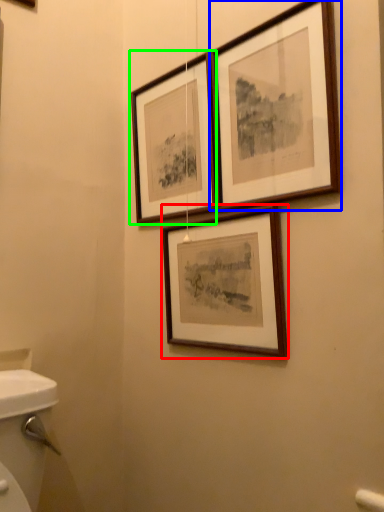
Question: Which object is the farthest from picture frame (highlighted by a red box)? Choose among these: picture frame (highlighted by a blue box) or picture frame (highlighted by a green box).

Choices:
 (A) picture frame
 (B) picture frame

Answer: (B)